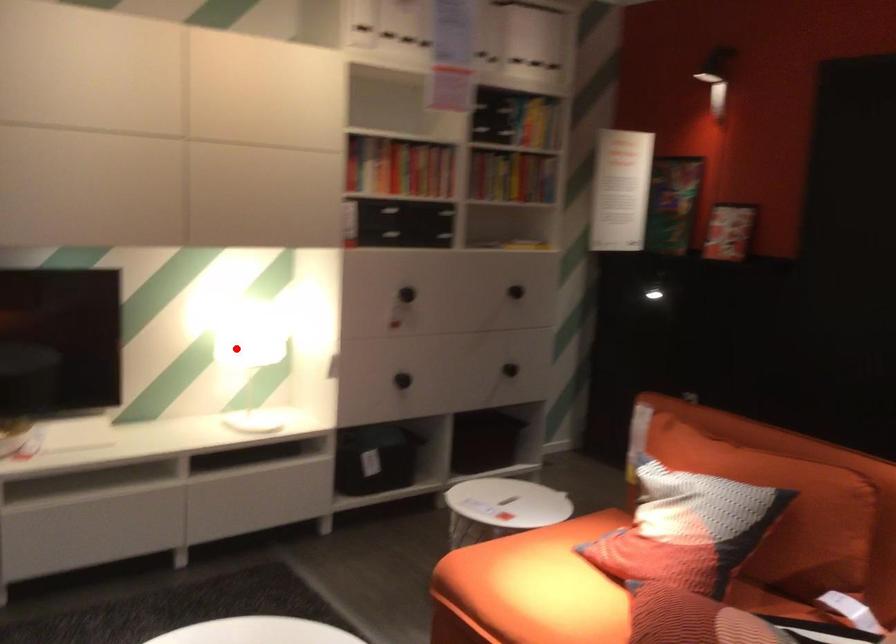
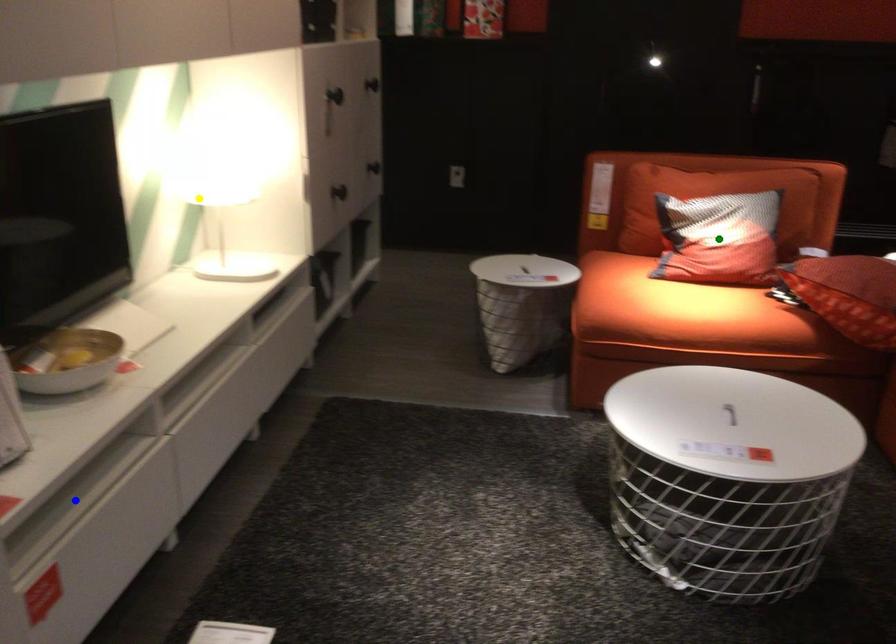
Question: I am providing you with two images of the same scene from different viewpoints. A red point is marked on the first image. You are given multiple points on the second image. Which spot in image 2 lines up with the point in image 1?

Choices:
 (A) green point
 (B) yellow point
 (C) blue point

Answer: (B)